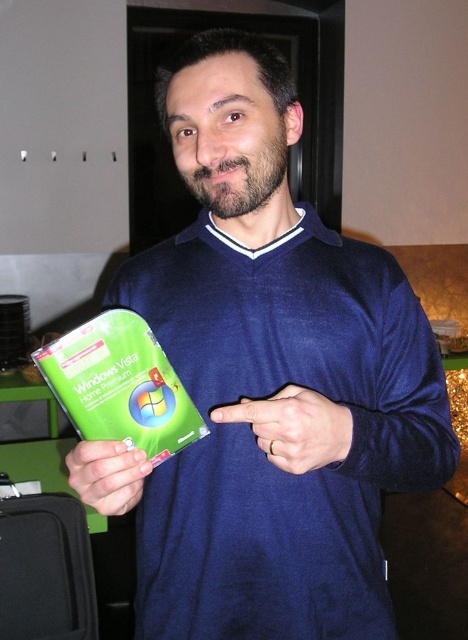
Question: Considering the relative positions of green plastic windows vista home premium at center and matte green plastic at lower left in the image provided, where is green plastic windows vista home premium at center located with respect to matte green plastic at lower left?

Choices:
 (A) left
 (B) right

Answer: (B)

Question: Which of these objects is positioned farthest from the matte green plastic at lower left?

Choices:
 (A) green plastic windows vista home premium at center
 (B) matte blue hand at center

Answer: (B)

Question: Does green plastic windows vista home premium at center have a greater width compared to matte green plastic at lower left?

Choices:
 (A) yes
 (B) no

Answer: (A)

Question: Which of the following is the closest to the observer?

Choices:
 (A) (294, 410)
 (B) (162, 392)
 (C) (102, 488)

Answer: (A)

Question: Can you confirm if matte blue hand at center is bigger than matte green plastic at lower left?

Choices:
 (A) no
 (B) yes

Answer: (A)

Question: Which of the following is the farthest from the observer?

Choices:
 (A) (277, 416)
 (B) (121, 484)
 (C) (83, 436)

Answer: (C)